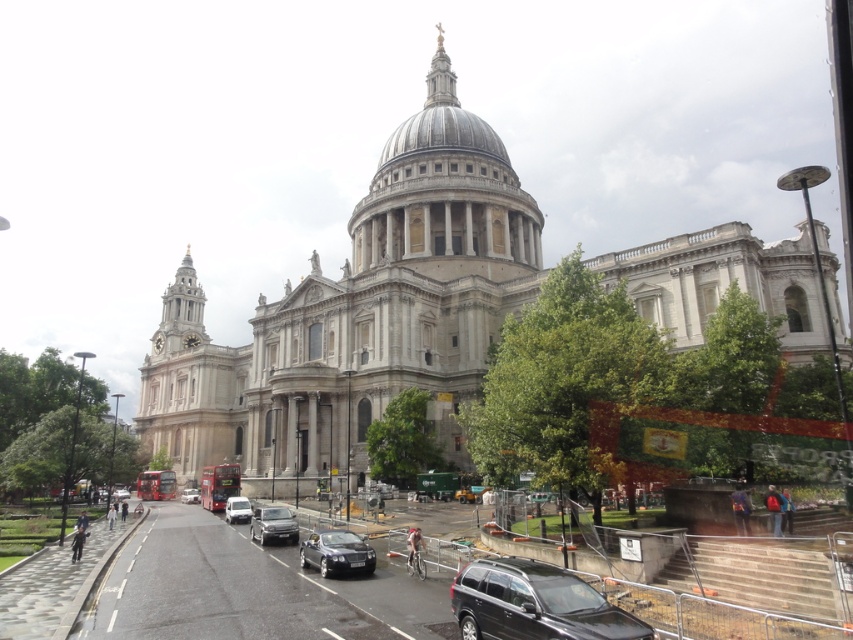
Question: Does black matte suv at lower center appear under silver metallic car at center?

Choices:
 (A) yes
 (B) no

Answer: (B)

Question: Which of the following is the farthest from the observer?

Choices:
 (A) shiny black car at center
 (B) metallic silver car at center

Answer: (B)

Question: Which point is farther from the camera taking this photo?

Choices:
 (A) (126, 497)
 (B) (407, 132)
 (C) (287, 525)
 (D) (196, 499)

Answer: (B)

Question: Where is shiny black car at center located in relation to silver metallic car at center in the image?

Choices:
 (A) above
 (B) below

Answer: (A)

Question: In this image, where is shiny black car at center located relative to silver metallic car at center?

Choices:
 (A) right
 (B) left

Answer: (A)

Question: Considering the real-world distances, which object is closest to the shiny black car at center?

Choices:
 (A) white stone cathedral at center
 (B) black matte suv at lower center
 (C) shiny silver car at center

Answer: (B)